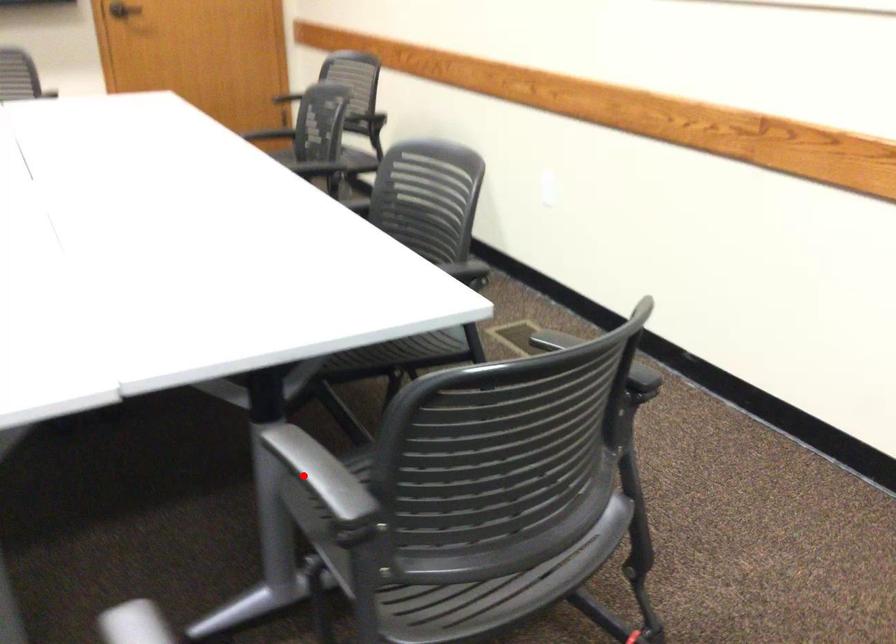
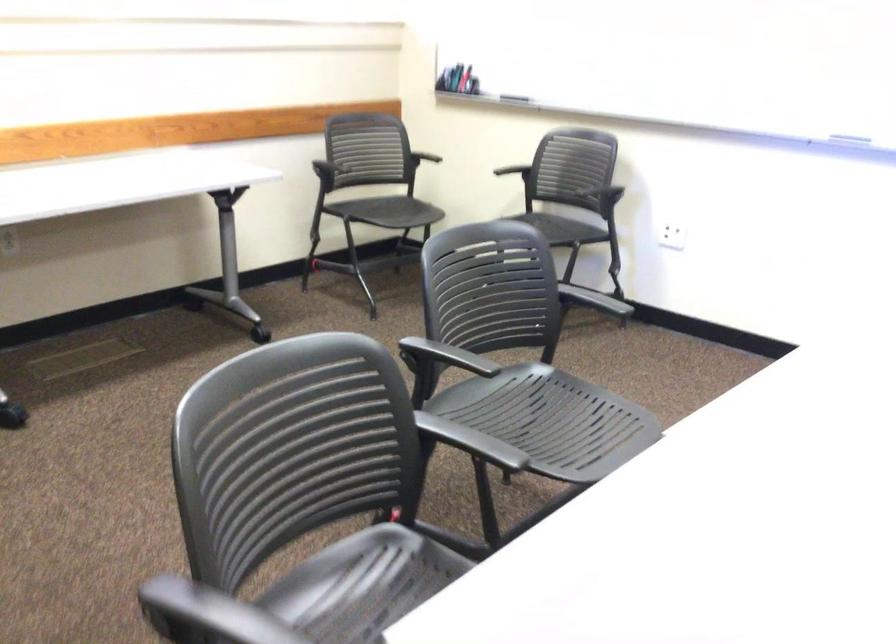
Question: A red point is marked in image1. In image2, is the corresponding 3D point closer to the camera or farther? Reply with the corresponding letter.

Choices:
 (A) The corresponding 3D point is closer.
 (B) The corresponding 3D point is farther.

Answer: (B)